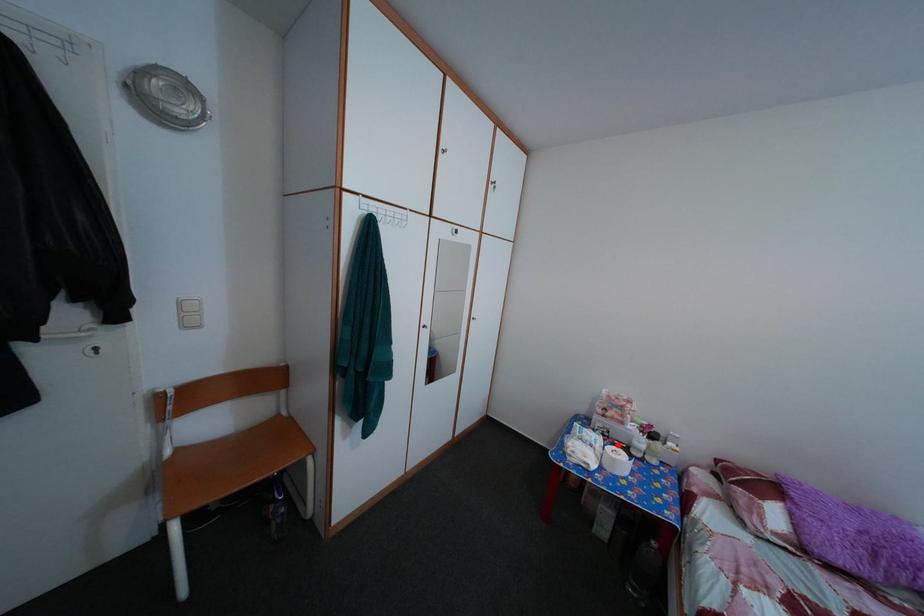
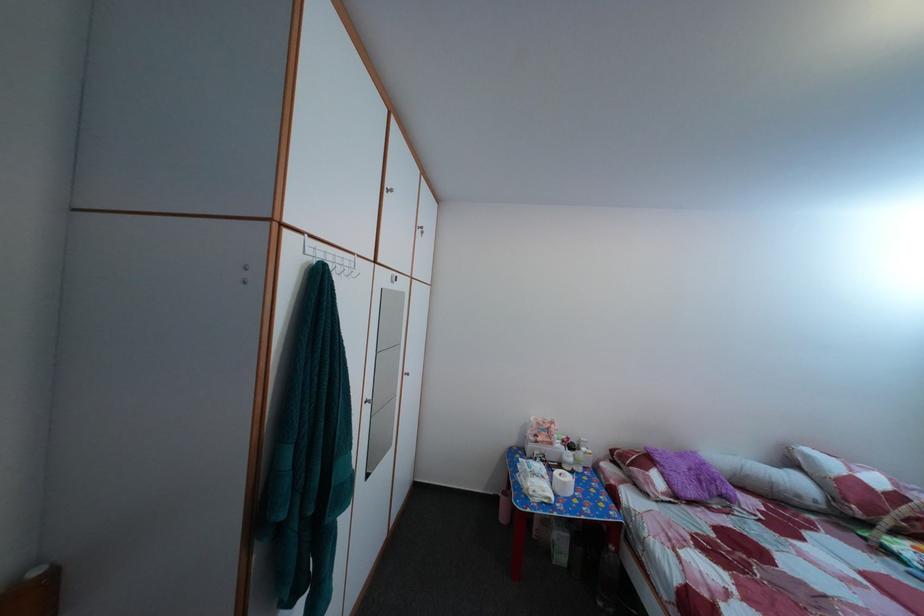
Locate, in the second image, the point that corresponds to the highlighted location in the first image.

(555, 469)